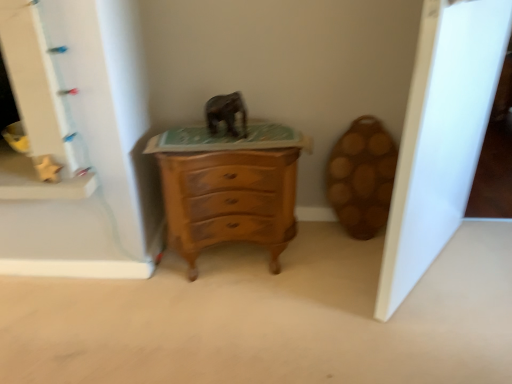
Locate an element on the screen. vacant area that is in front of matte gray elephant at center is located at coordinates (221, 143).